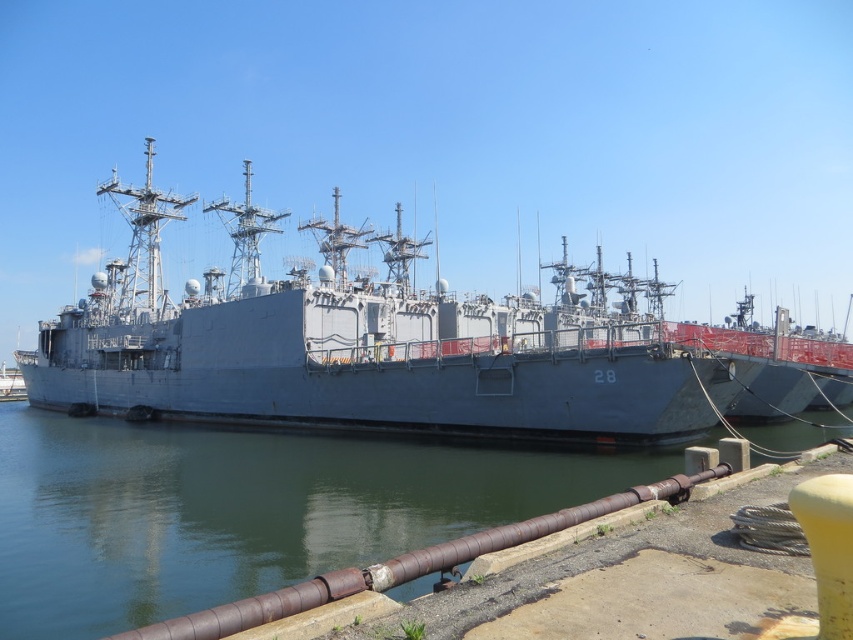
Question: Which of the following is the farthest from the observer?

Choices:
 (A) (363, 288)
 (B) (170, 529)

Answer: (A)

Question: Can you confirm if gray metallic ship at center is bigger than greenish water at lower left?

Choices:
 (A) yes
 (B) no

Answer: (A)

Question: Which point is closer to the camera?

Choices:
 (A) greenish water at lower left
 (B) gray metallic ship at center

Answer: (A)

Question: Does gray metallic ship at center have a smaller size compared to greenish water at lower left?

Choices:
 (A) no
 (B) yes

Answer: (A)

Question: Among these points, which one is farthest from the camera?

Choices:
 (A) (209, 515)
 (B) (355, 429)

Answer: (B)

Question: Does gray metallic ship at center have a lesser width compared to greenish water at lower left?

Choices:
 (A) no
 (B) yes

Answer: (A)